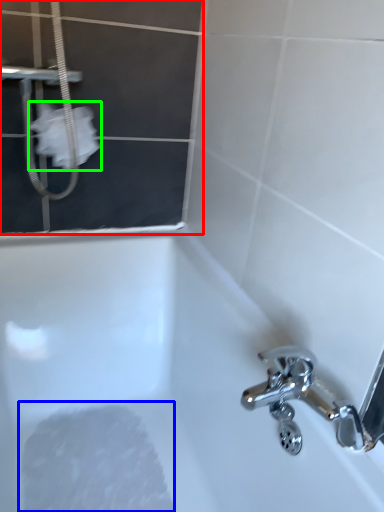
Question: Based on their relative distances, which object is farther from screen door (highlighted by a red box)? Choose from foam (highlighted by a blue box) and toilet paper (highlighted by a green box).

Choices:
 (A) foam
 (B) toilet paper

Answer: (A)